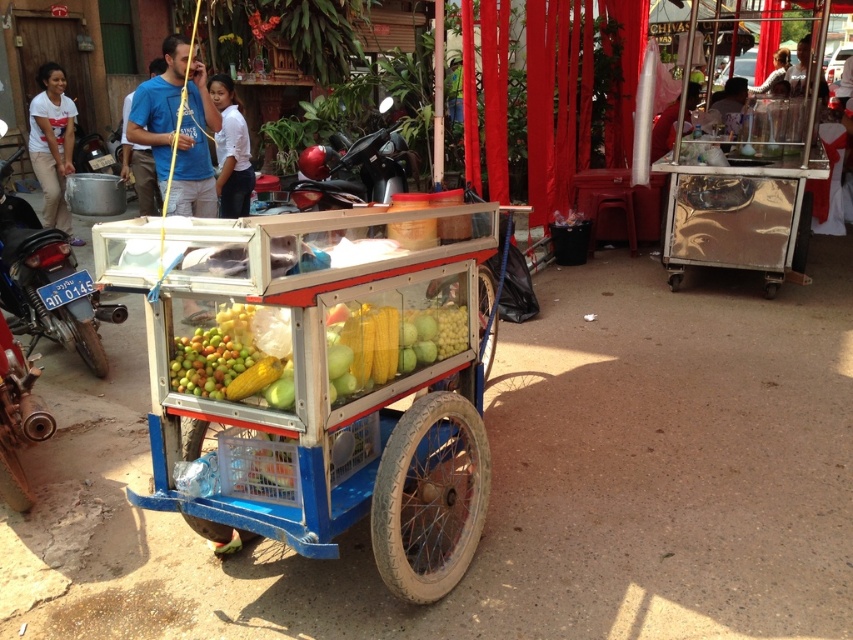
You are standing at the back of the fruit cart and want to reach a point that is behind the cart. Which of the two points, point (418, 177) or point (54, 179), is closer to the back of the cart?

Point (54, 179) is closer to the back of the cart because it is behind point (418, 177).

You are a delivery person who needs to park your shiny black motorcycle at center near the fruit cart. However, there is a white cotton shirt at upper left hanging above the parking spot. Is there enough space to park the motorcycle without touching the shirt?

The shiny black motorcycle at center is positioned under the white cotton shirt at upper left, so there is enough vertical space to park the motorcycle without touching the shirt.

Where is the shiny black motorcycle at center located in the image?

Result: The shiny black motorcycle at center is located at point coordinates of (352, 172).